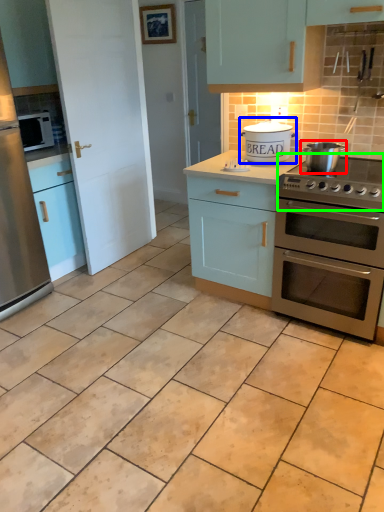
Question: Estimate the real-world distances between objects in this image. Which object is farther from appliance (highlighted by a red box), appliance (highlighted by a blue box) or gas stove (highlighted by a green box)?

Choices:
 (A) appliance
 (B) gas stove

Answer: (A)